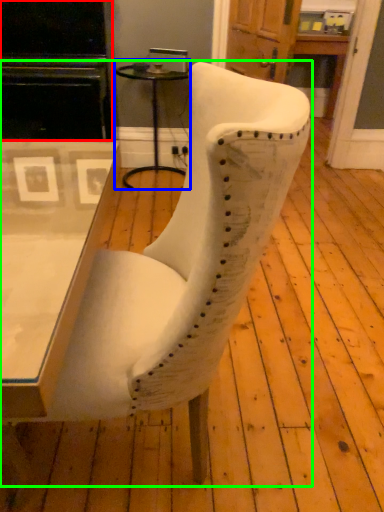
Question: Which object is the closest to the entertainment center (highlighted by a red box)? Choose among these: side table (highlighted by a blue box) or chair (highlighted by a green box).

Choices:
 (A) side table
 (B) chair

Answer: (A)